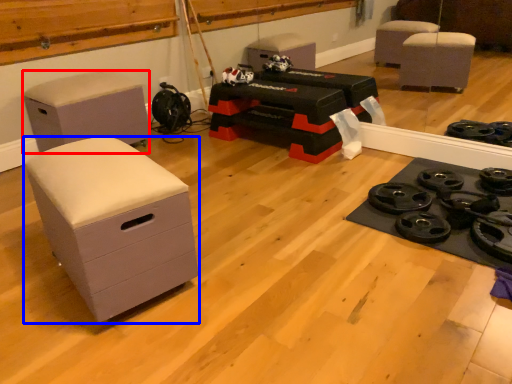
Question: Which point is further to the camera, furniture (highlighted by a red box) or chest of drawers (highlighted by a blue box)?

Choices:
 (A) furniture
 (B) chest of drawers

Answer: (A)